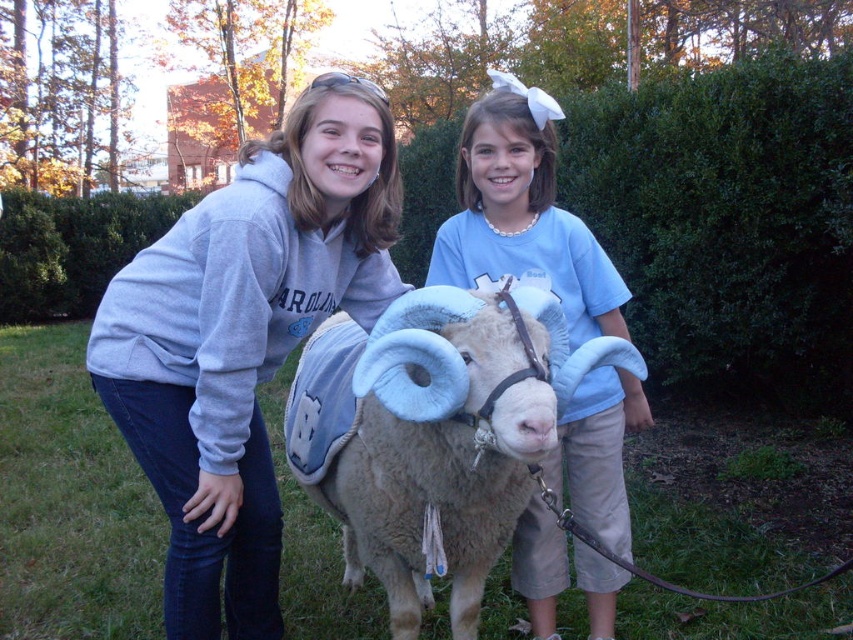
Question: Is gray fleece sweatshirt at left in front of light brown woolen sheep at center?

Choices:
 (A) no
 (B) yes

Answer: (A)

Question: Among these objects, which one is nearest to the camera?

Choices:
 (A) light brown woolen sheep at center
 (B) blue cotton shirt at center
 (C) gray fleece sweatshirt at left

Answer: (A)

Question: In this image, where is gray fleece sweatshirt at left located relative to blue cotton shirt at center?

Choices:
 (A) left
 (B) right

Answer: (A)

Question: Among these points, which one is farthest from the camera?

Choices:
 (A) (358, 256)
 (B) (405, 464)

Answer: (A)

Question: Is gray fleece sweatshirt at left to the right of blue cotton shirt at center from the viewer's perspective?

Choices:
 (A) no
 (B) yes

Answer: (A)

Question: Which point is closer to the camera taking this photo?

Choices:
 (A) (396, 412)
 (B) (634, 404)

Answer: (A)